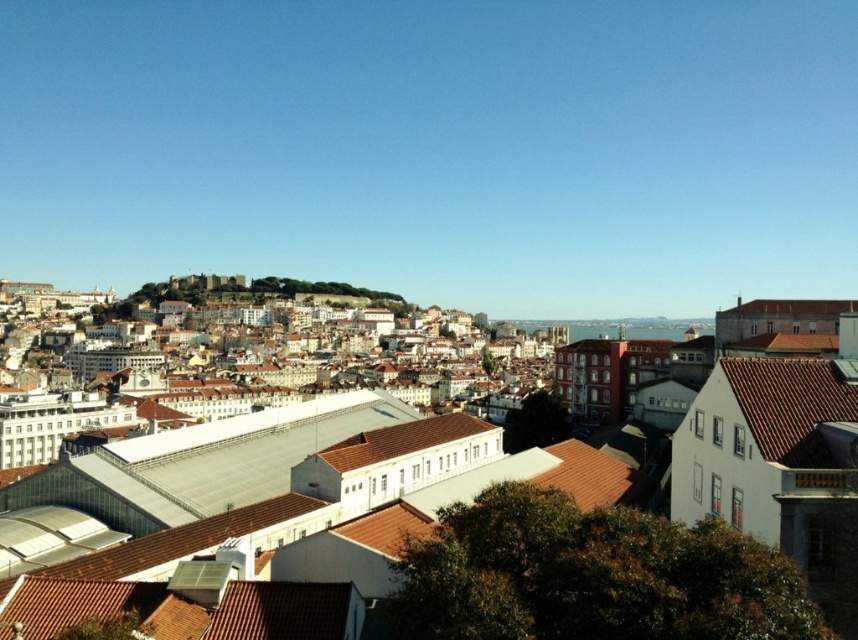
Does point (713, 544) come closer to viewer compared to point (819, 387)?

Yes, point (713, 544) is closer to viewer.

Does brown tiled roofs at center have a larger size compared to brown tile roof at right?

Indeed, brown tiled roofs at center has a larger size compared to brown tile roof at right.

Does point (300, 627) lie in front of point (768, 401)?

Yes, point (300, 627) is closer to viewer.

Locate an element on the screen. The width and height of the screenshot is (858, 640). brown tiled roofs at center is located at coordinates (754, 522).